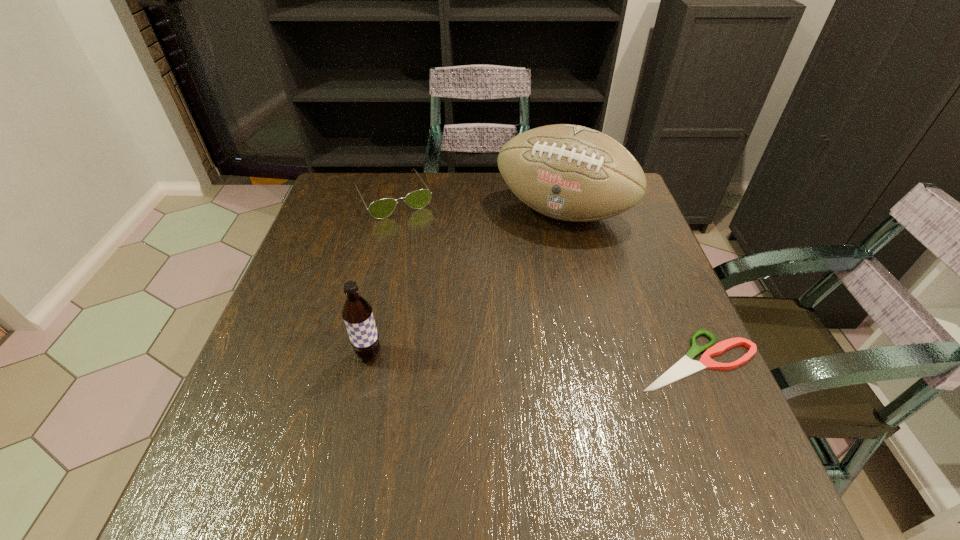
Image resolution: width=960 pixels, height=540 pixels. I want to click on free space located 0.390m on the front-facing side of the third tallest object, so click(x=464, y=316).

The width and height of the screenshot is (960, 540). In order to click on vacant space located 0.370m on the front-facing side of the third tallest object in this screenshot , I will do `click(460, 310)`.

This screenshot has width=960, height=540. In order to click on football (American) that is at the far edge in this screenshot , I will do `click(573, 173)`.

Locate an element on the screen. The image size is (960, 540). sunglasses that is at the far edge is located at coordinates 380,209.

This screenshot has width=960, height=540. In order to click on object present at the left edge in this screenshot , I will do `click(380, 209)`.

I want to click on scissors positioned at the right edge, so click(x=685, y=366).

Identify the location of football (American) positioned at the right edge. (573, 173).

This screenshot has width=960, height=540. I want to click on object that is positioned at the far left corner, so click(380, 209).

In order to click on object that is at the far right corner in this screenshot , I will do `click(573, 173)`.

Find the location of a particular element. This screenshot has width=960, height=540. vacant point at the far edge is located at coordinates coord(405,182).